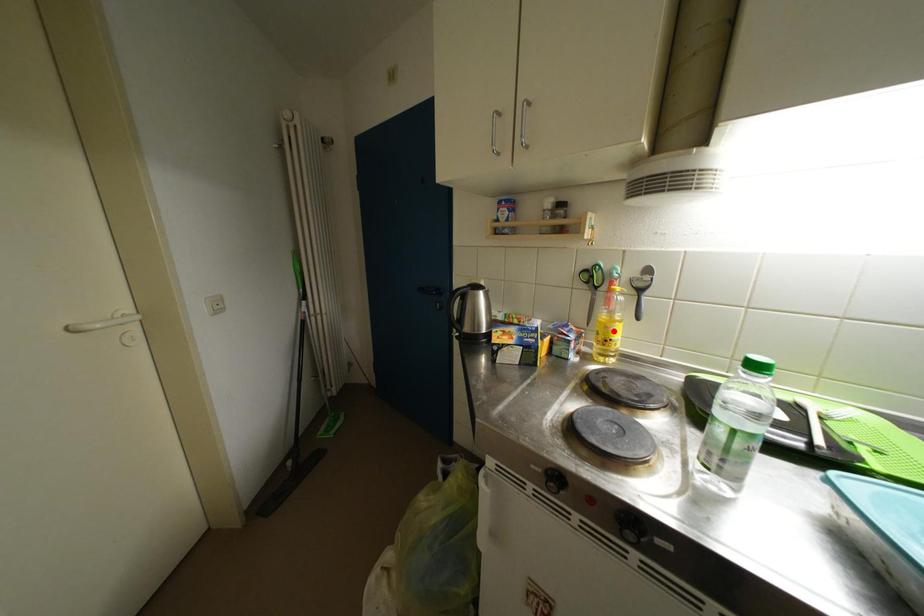
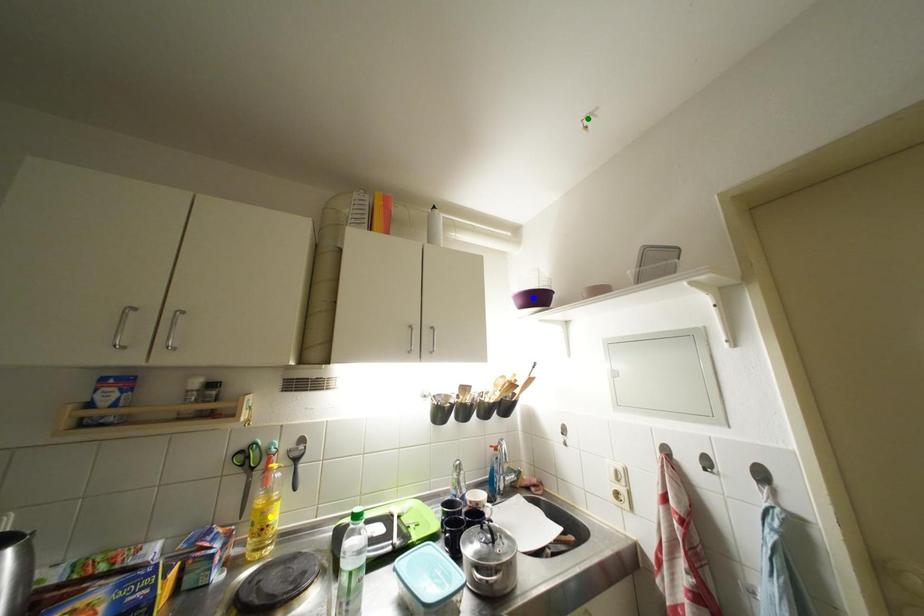
Question: I am providing you with two images of the same scene from different viewpoints. A red point is marked on the first image. You are given multiple points on the second image. Which point in image 2 represents the same 3d spot as the red point in image 1?

Choices:
 (A) blue point
 (B) green point
 (C) yellow point

Answer: (C)